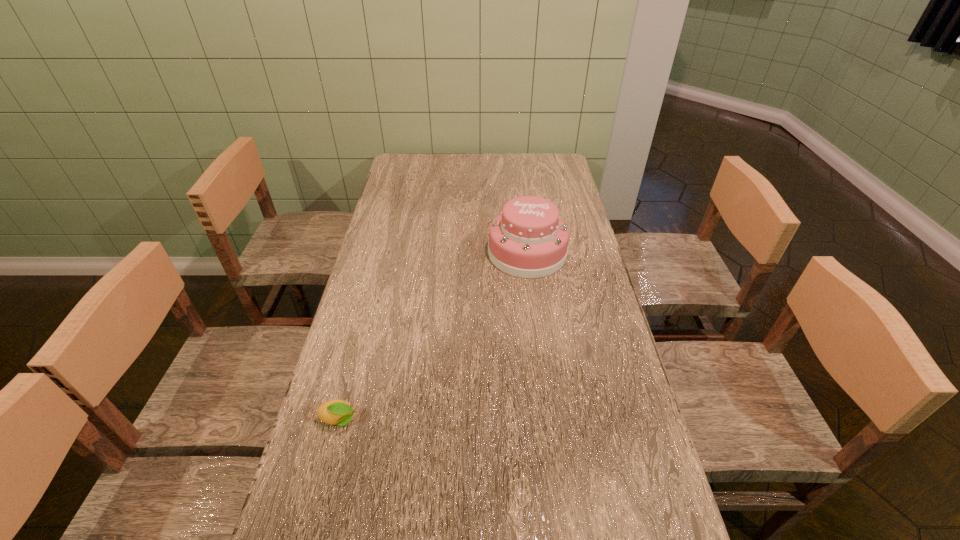
This screenshot has height=540, width=960. Identify the location of free location at the right edge. (597, 276).

Where is `free region at the far left corner of the desktop`? free region at the far left corner of the desktop is located at coordinates (399, 163).

Locate an element on the screen. The image size is (960, 540). free point at the far right corner is located at coordinates coord(547,161).

Where is `vacant space that satisfies the following two spatial constraints: 1. on the front side of the cake; 2. with leaves positioned above the lemon`? The height and width of the screenshot is (540, 960). vacant space that satisfies the following two spatial constraints: 1. on the front side of the cake; 2. with leaves positioned above the lemon is located at coordinates (548, 420).

Locate an element on the screen. This screenshot has width=960, height=540. free region that satisfies the following two spatial constraints: 1. on the front side of the cake; 2. with leaves positioned above the shorter object is located at coordinates [548, 420].